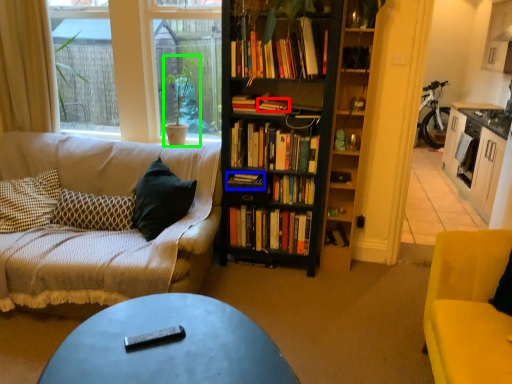
Question: Which is farther away from book (highlighted by a red box)? book (highlighted by a blue box) or houseplant (highlighted by a green box)?

Choices:
 (A) book
 (B) houseplant

Answer: (B)